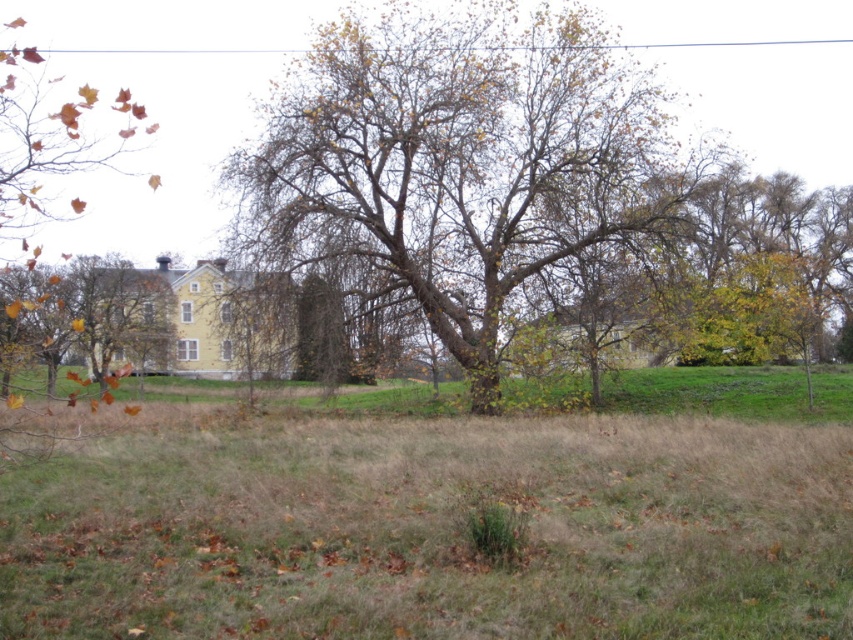
Is brown grass at center wider than brown rough bark tree at center?

No.

Looking at this image, who is positioned more to the left, brown grass at center or brown rough bark tree at center?

brown grass at center

Identify the location of brown grass at center. pos(440,515).